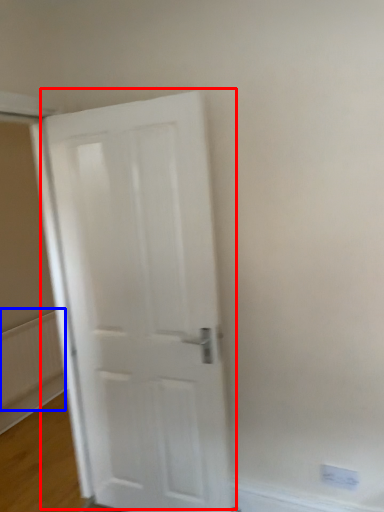
Question: Which object appears closest to the camera in this image, door (highlighted by a red box) or radiator (highlighted by a blue box)?

Choices:
 (A) door
 (B) radiator

Answer: (A)